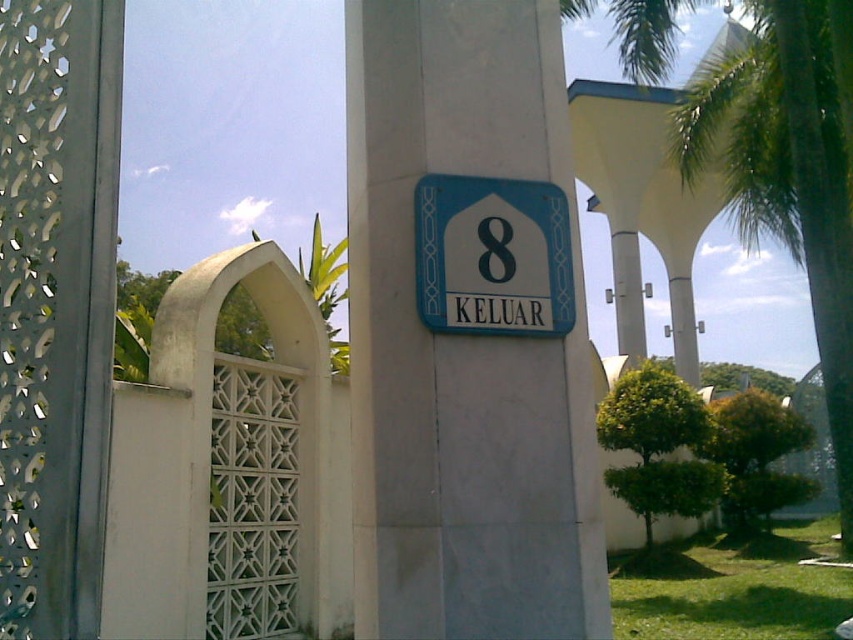
Question: Can you confirm if white smooth pillar at center is smaller than green leafy palm tree at right?

Choices:
 (A) yes
 (B) no

Answer: (B)

Question: Which point appears farthest from the camera in this image?

Choices:
 (A) tap(456, 209)
 (B) tap(776, 188)
 (C) tap(366, 272)

Answer: (B)

Question: Which object is positioned closest to the white smooth pillar at center?

Choices:
 (A) green leafy palm tree at right
 (B) blue plastic sign at center

Answer: (B)

Question: Which point appears farthest from the camera in this image?

Choices:
 (A) (529, 268)
 (B) (816, 173)

Answer: (B)

Question: Does green leafy palm tree at right appear over blue plastic sign at center?

Choices:
 (A) yes
 (B) no

Answer: (B)

Question: Can you confirm if white smooth pillar at center is smaller than blue plastic sign at center?

Choices:
 (A) no
 (B) yes

Answer: (A)